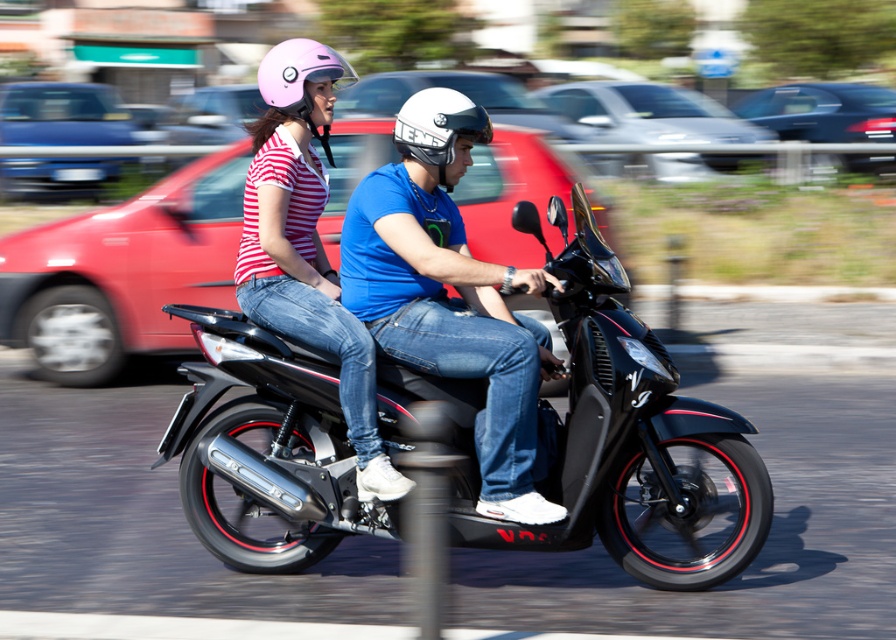
Looking at this image, is shiny black scooter at center to the right of white matte helmet at center from the viewer's perspective?

Incorrect, shiny black scooter at center is not on the right side of white matte helmet at center.

Describe the element at coordinates (395, 266) in the screenshot. I see `shiny black scooter at center` at that location.

Does point (289, 202) come in front of point (415, 112)?

No.

Where is `shiny black scooter at center`? The image size is (896, 640). shiny black scooter at center is located at coordinates (395, 266).

Based on the photo, who is more forward, [309,100] or [408,156]?

Point [408,156] is more forward.

Image resolution: width=896 pixels, height=640 pixels. I want to click on pink matte helmet at upper center, so click(x=300, y=81).

Can you confirm if black matte scooter at center is smaller than shiny black scooter at center?

Incorrect, black matte scooter at center is not smaller in size than shiny black scooter at center.

Locate an element on the screen. The width and height of the screenshot is (896, 640). black matte scooter at center is located at coordinates (608, 442).

Locate an element on the screen. The height and width of the screenshot is (640, 896). black matte scooter at center is located at coordinates (608, 442).